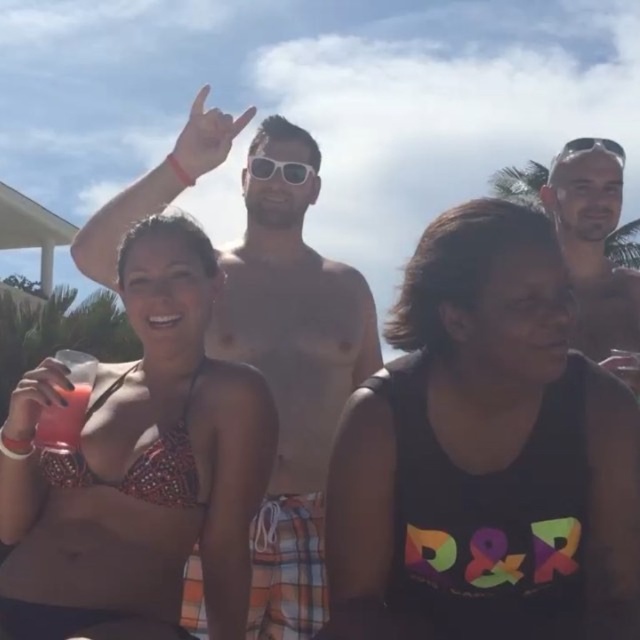
Can you confirm if matte black sunglasses at upper right is wider than translucent plastic cup at lower left?

Indeed, matte black sunglasses at upper right has a greater width compared to translucent plastic cup at lower left.

Is matte black sunglasses at upper right smaller than translucent plastic cup at lower left?

No.

Between point (582, 154) and point (72, 384), which one is positioned behind?

The point (582, 154) is behind.

Find the location of a particular element. This screenshot has height=640, width=640. matte black sunglasses at upper right is located at coordinates (595, 250).

Is black matte tank top at center positioned behind translucent plastic cup at lower left?

No.

Where is `black matte tank top at center`? The image size is (640, 640). black matte tank top at center is located at coordinates (484, 454).

Who is lower down, sparkly red bikini top at lower left or sunglasses at upper right?

sparkly red bikini top at lower left

Is sparkly red bikini top at lower left bigger than sunglasses at upper right?

Incorrect, sparkly red bikini top at lower left is not larger than sunglasses at upper right.

This screenshot has height=640, width=640. What do you see at coordinates (140, 467) in the screenshot? I see `sparkly red bikini top at lower left` at bounding box center [140, 467].

Where is `sparkly red bikini top at lower left`? The width and height of the screenshot is (640, 640). sparkly red bikini top at lower left is located at coordinates (140, 467).